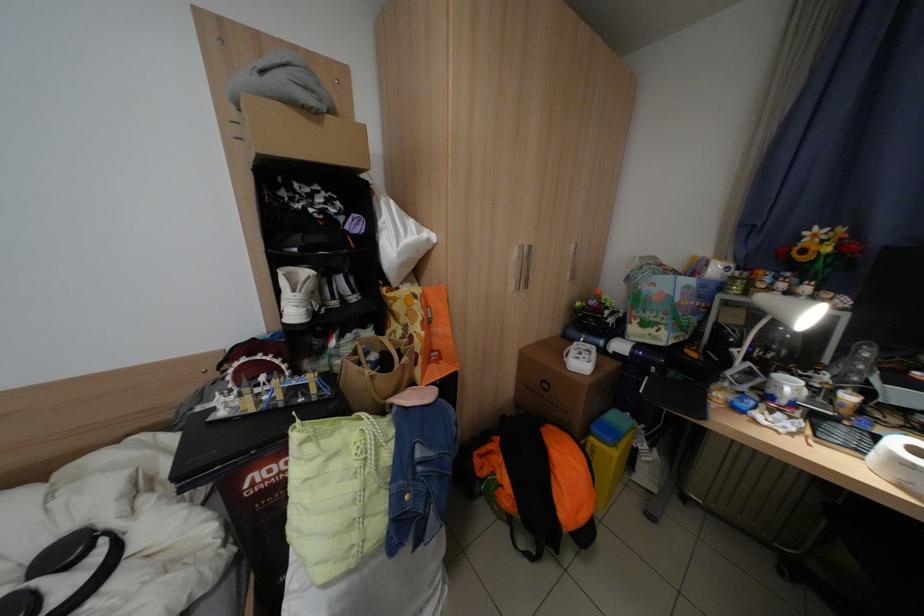
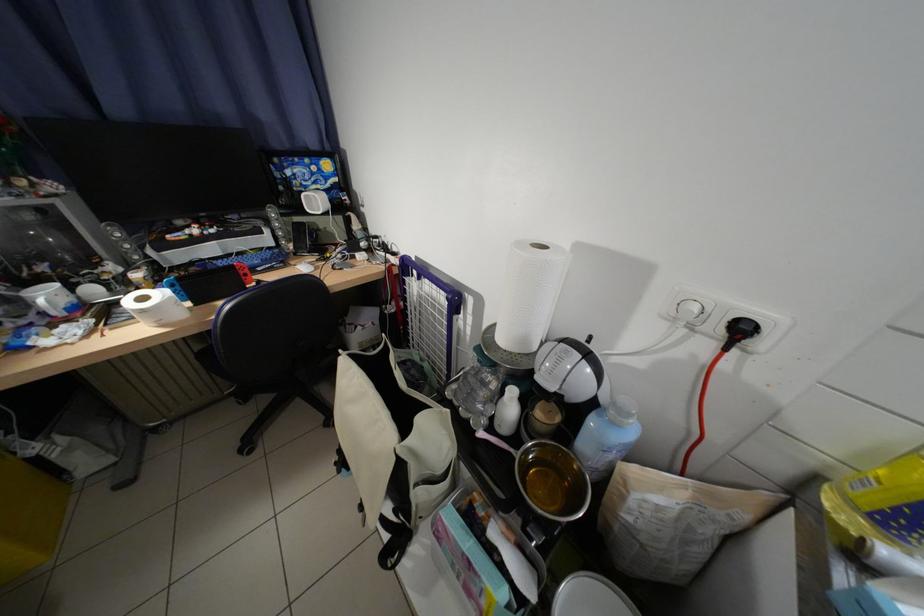
How did the camera likely rotate?

The camera's rotation is toward right-down.